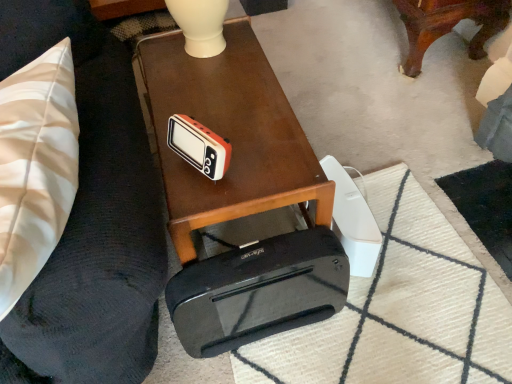
Image resolution: width=512 pixels, height=384 pixels. Find the location of `spots to the right of black plastic cassette at lower center`. spots to the right of black plastic cassette at lower center is located at coordinates (372, 328).